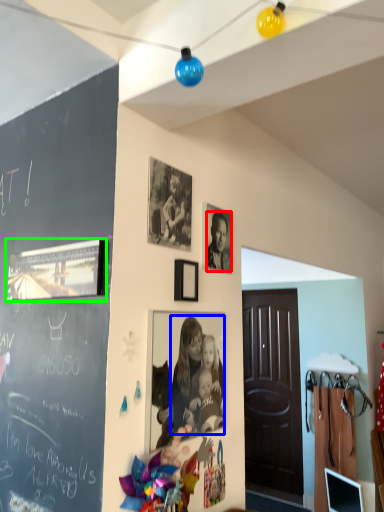
Question: Based on their relative distances, which object is nearer to person (highlighted by a red box)? Choose from person (highlighted by a blue box) and picture frame (highlighted by a green box).

Choices:
 (A) person
 (B) picture frame

Answer: (A)